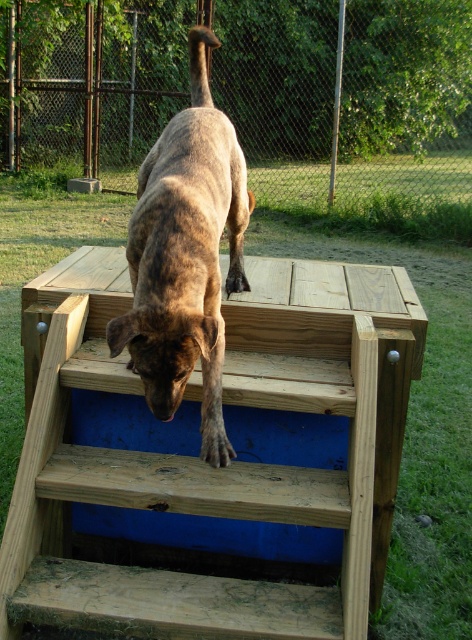
Question: Is wooden stairs at center bigger than brown brindle dog at center?

Choices:
 (A) yes
 (B) no

Answer: (B)

Question: Is wooden stairs at center above brown brindle dog at center?

Choices:
 (A) yes
 (B) no

Answer: (B)

Question: Which object appears farthest from the camera in this image?

Choices:
 (A) wooden stairs at center
 (B) brown brindle dog at center

Answer: (A)

Question: Can you confirm if wooden stairs at center is smaller than brown brindle dog at center?

Choices:
 (A) no
 (B) yes

Answer: (B)